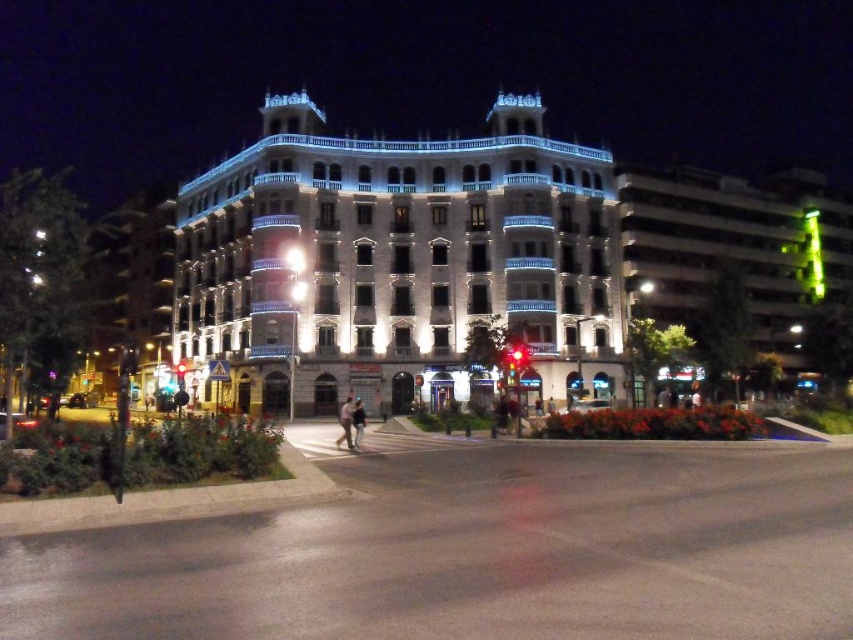
From the picture: Does white glossy building at center appear on the right side of brown leather jacket at center?

Incorrect, white glossy building at center is not on the right side of brown leather jacket at center.

Which of these two, white glossy building at center or brown leather jacket at center, stands taller?

white glossy building at center

Where is `white glossy building at center`? This screenshot has width=853, height=640. white glossy building at center is located at coordinates (396, 262).